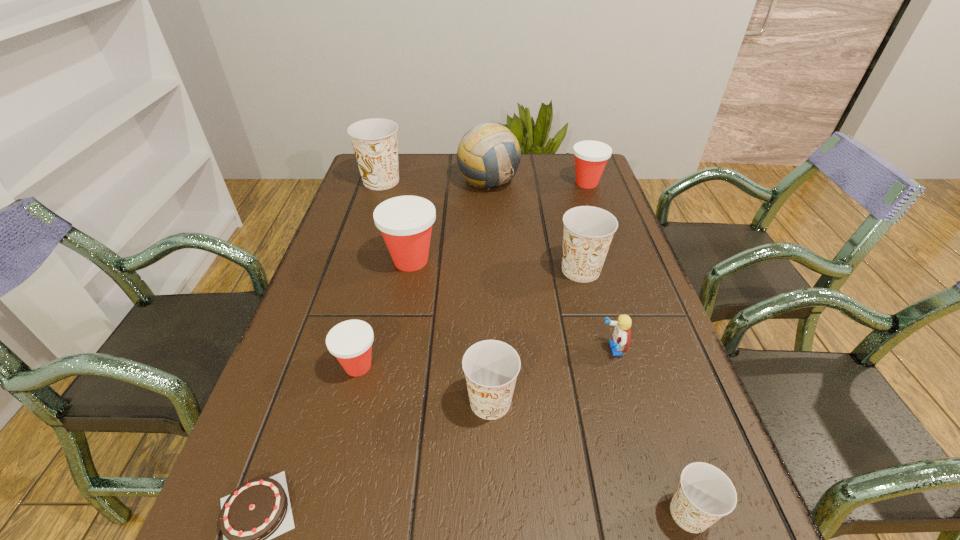
Find the location of a particular element. The image size is (960, 540). free location that satisfies the following two spatial constraints: 1. on the back side of the volleyball; 2. on the right side of the nearest red-orange Dixie cup is located at coordinates (404, 181).